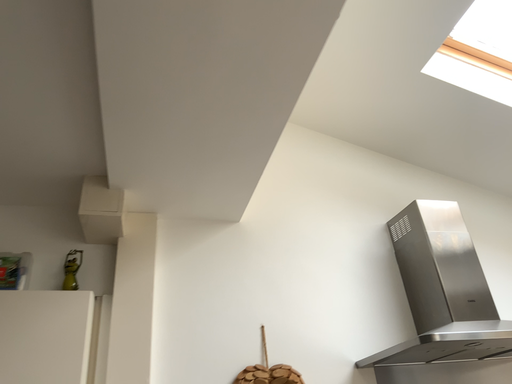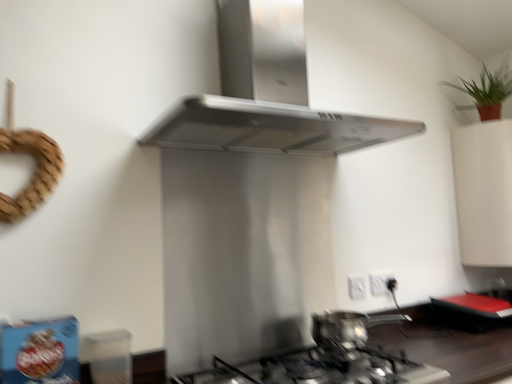
Question: How did the camera likely rotate when shooting the video?

Choices:
 (A) rotated left
 (B) rotated right

Answer: (B)